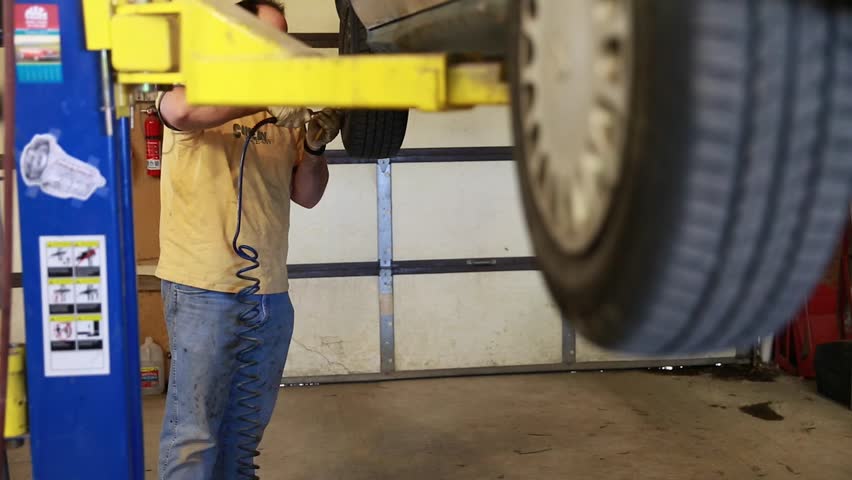
Image resolution: width=852 pixels, height=480 pixels. In order to click on fire extinguisher in this screenshot , I will do point(147,153).